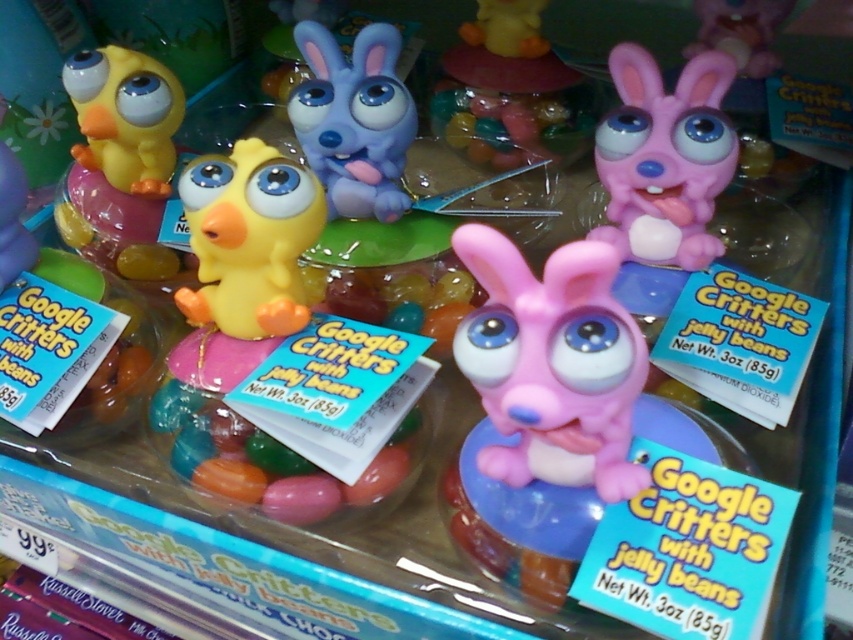
Where is the pink rubber bunny at upper right located in the display?

The pink rubber bunny at upper right is located at point (x=665, y=157) in the display.

You are a customer at a toy store looking at the display of Google Critters with Jelly Beans. You notice a matte pink plastic bunny at center. Can you tell me the exact coordinates of where this bunny is located in the display?

The matte pink plastic bunny at center is located at coordinates point (552, 364).